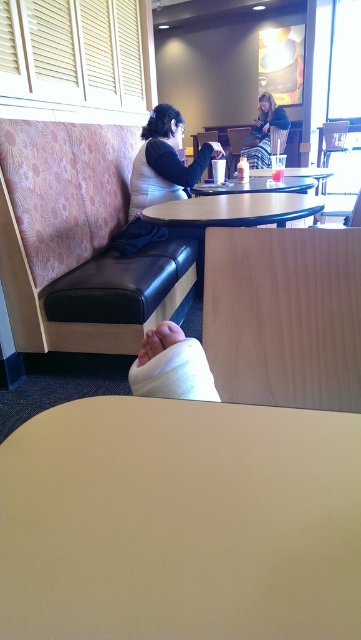
You are a barista trying to place a new menu board on the smooth white table at center. The menu board is as wide as the matte white shirt at center. Will the menu board fit on the table?

The matte white shirt at center is narrower than the smooth white table at center, so the menu board, being the same width as the matte white shirt at center, will fit on the smooth white table at center.

You are at a cafe and want to sit at the booth with the patterned pink and white floral backrest. There is a person at point (164,161) wearing a matte white shirt at center. Can you sit there without moving the person?

The person at point (164,161) is wearing a matte white shirt at center and is already seated at the booth, so you would need to wait for them to leave before sitting there.

You are a photographer setting up a shoot in this cafe. You have a matte white shirt at center and a smooth white table at center in your frame. Which object should you zoom in on to focus on the smaller one?

The matte white shirt at center is smaller than the smooth white table at center, so you should zoom in on the matte white shirt at center to focus on the smaller one.